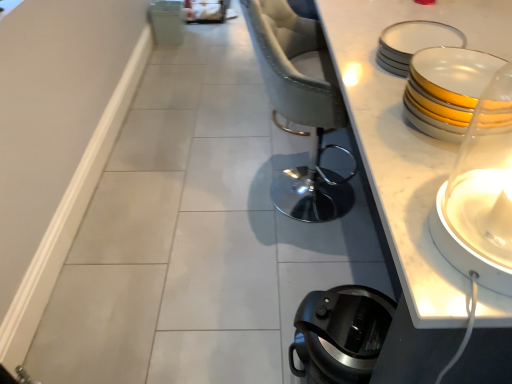
Locate an element on the screen. The width and height of the screenshot is (512, 384). free space to the back side of sleek gray fabric chair at center is located at coordinates (277, 137).